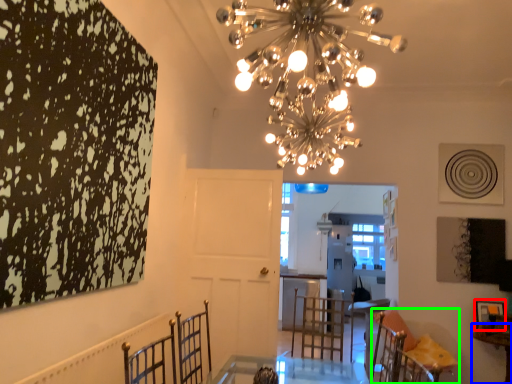
Question: Which is farther away from picture frame (highlighted by a red box)? table (highlighted by a blue box) or furniture (highlighted by a green box)?

Choices:
 (A) table
 (B) furniture

Answer: (B)